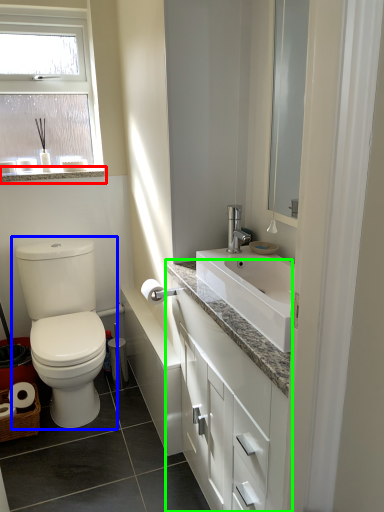
Question: Based on their relative distances, which object is nearer to window sill (highlighted by a red box)? Choose from toilet (highlighted by a blue box) and bathroom cabinet (highlighted by a green box).

Choices:
 (A) toilet
 (B) bathroom cabinet

Answer: (A)